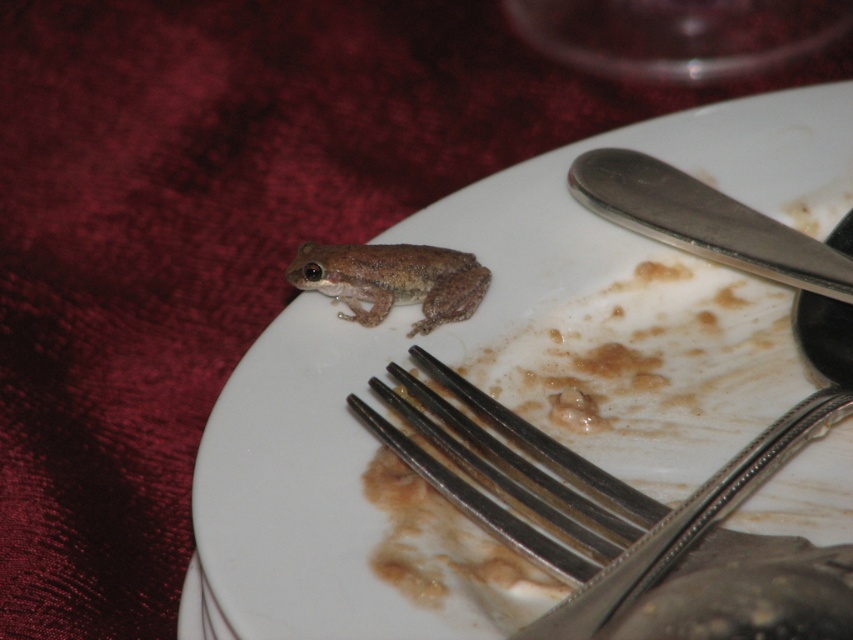
You are a chef holding a spoon and need to reach for the silver metallic fork at lower center. If your hand can extend 1 meter, will you be able to reach it without moving your body?

The silver metallic fork at lower center is 1.04 meters away from the camera, so the chef cannot reach it with a 1 meter extension since it is slightly farther away.

You are a chef who needs to place a 1.5 meter long ribbon diagonally across the point at (741, 208). Will the ribbon fit within the tablecloth?

The distance between the two points is 1.37 meters, which is shorter than the ribbon length of 1.5 meters. Therefore, the ribbon will not fit diagonally across the tablecloth.